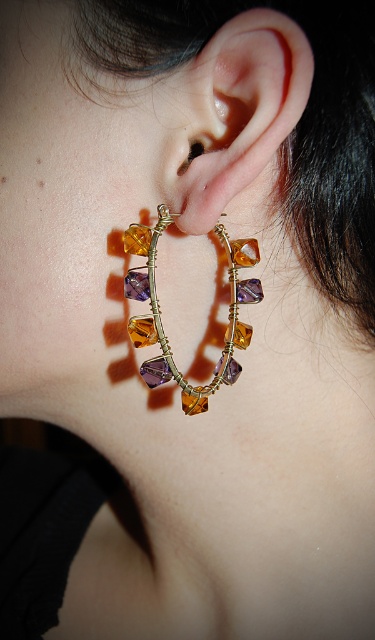
Question: Is clear crystal earring at center in front of amber-gold wire hoop at ear?

Choices:
 (A) yes
 (B) no

Answer: (A)

Question: Which object is farther from the camera taking this photo?

Choices:
 (A) clear crystal earring at center
 (B) amber-gold wire hoop at ear

Answer: (B)

Question: Where is clear crystal earring at center located in relation to amber-gold wire hoop at ear in the image?

Choices:
 (A) above
 (B) below

Answer: (A)

Question: Does clear crystal earring at center appear over amber-gold wire hoop at ear?

Choices:
 (A) no
 (B) yes

Answer: (B)

Question: Among these points, which one is farthest from the camera?

Choices:
 (A) (178, 193)
 (B) (183, 403)

Answer: (B)